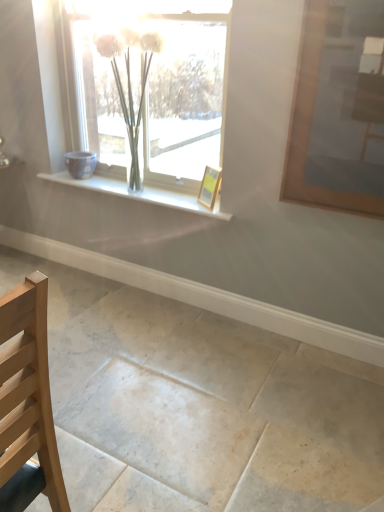
Question: Considering the positions of wooden picture frame at upper right, the second picture frame from the left, and wooden picture frame at center, the 1th picture frame positioned from the back, in the image, is wooden picture frame at upper right, the second picture frame from the left, bigger or smaller than wooden picture frame at center, the 1th picture frame positioned from the back,?

Choices:
 (A) big
 (B) small

Answer: (A)

Question: Is wooden picture frame at upper right, which ranks as the 2th picture frame in back-to-front order, situated inside wooden picture frame at center, the second picture frame positioned from the front, or outside?

Choices:
 (A) inside
 (B) outside

Answer: (B)

Question: Which object is positioned farthest from the light wood chair at lower left?

Choices:
 (A) clear glass vase at upper center
 (B) smooth stone floor at center
 (C) wooden picture frame at upper right, the second picture frame from the left
 (D) white glossy window sill at center
 (E) wooden picture frame at center, which ranks as the second picture frame in right-to-left order

Answer: (A)

Question: Which of these objects is positioned closest to the wooden picture frame at center, which ranks as the second picture frame in right-to-left order?

Choices:
 (A) white glossy window sill at center
 (B) light wood chair at lower left
 (C) smooth stone floor at center
 (D) clear glass vase at upper center
 (E) wooden picture frame at upper right, the second picture frame from the left

Answer: (A)